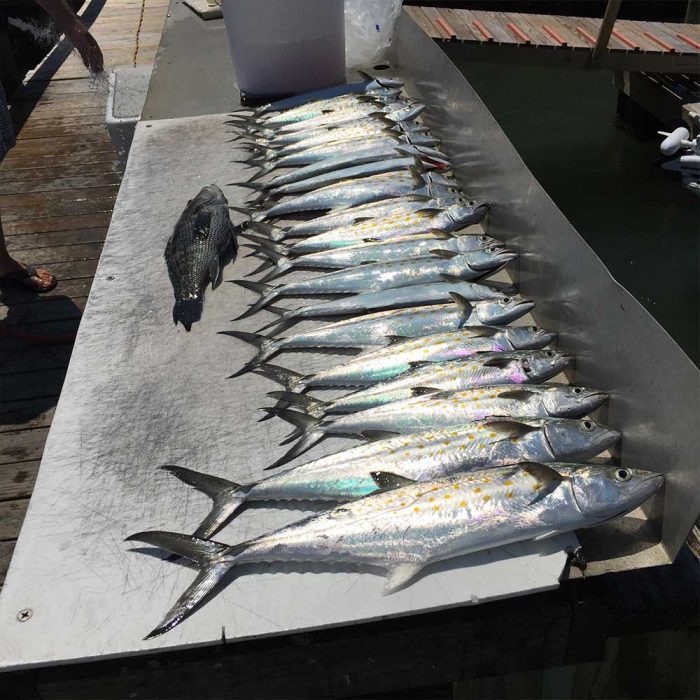
Find the location of a particular element. screws is located at coordinates (22, 616), (108, 280), (147, 127).